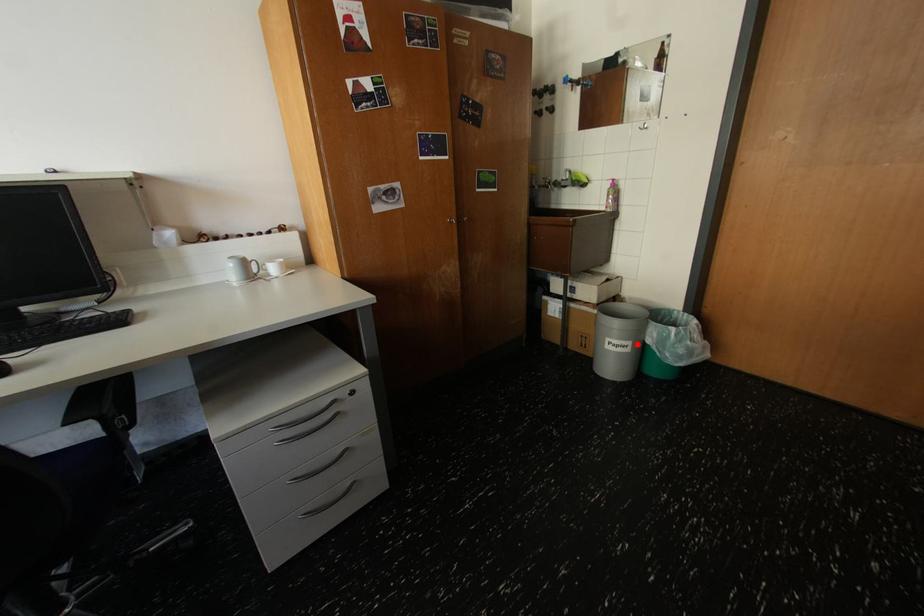
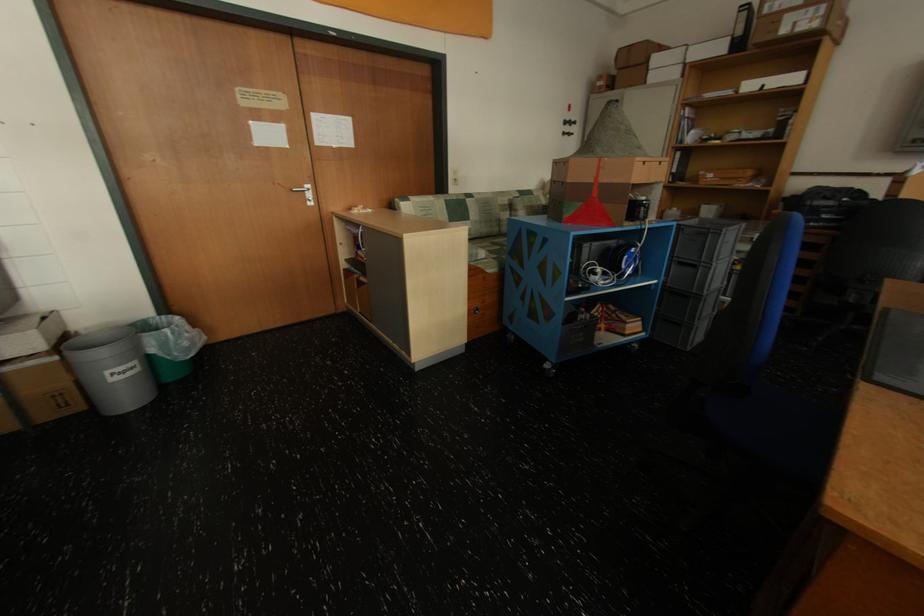
Where in the second image is the point corresponding to the highlighted location from the first image?

(142, 363)